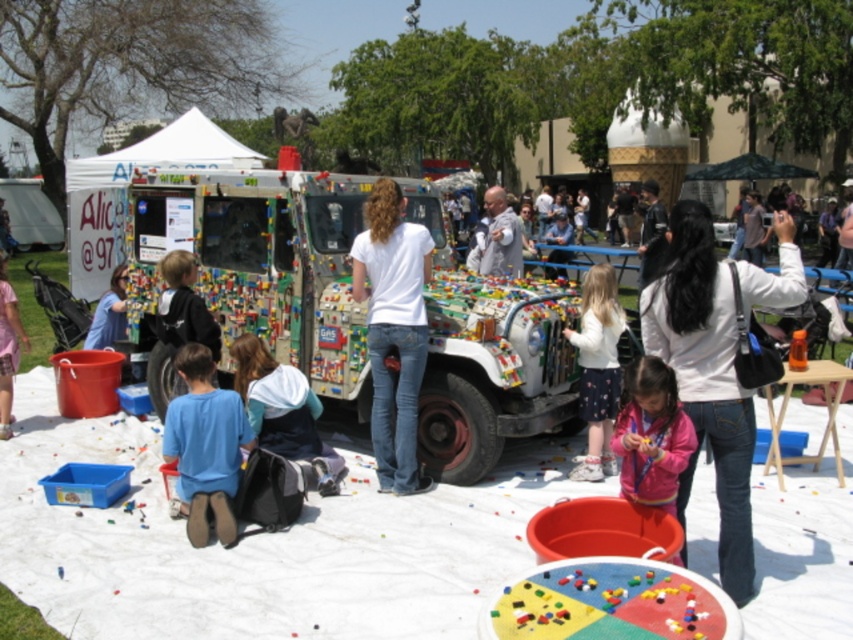
Question: Does brick-patterned plastic food truck at center have a lesser width compared to white matte jacket at upper right?

Choices:
 (A) yes
 (B) no

Answer: (B)

Question: From the image, what is the correct spatial relationship of blue cotton shirt at lower left in relation to blue denim jeans at lower left?

Choices:
 (A) below
 (B) above

Answer: (A)

Question: Considering the real-world distances, which object is farthest from the gray fabric jacket at center?

Choices:
 (A) white matte shirt at center
 (B) brick-patterned plastic food truck at center
 (C) multicolored plastic lego pieces at center
 (D) blue cotton shirt at lower left

Answer: (C)

Question: Is pink fleece jacket at lower center wider than white cotton shirt at center?

Choices:
 (A) yes
 (B) no

Answer: (B)

Question: Which object appears farthest from the camera in this image?

Choices:
 (A) blue denim jeans at lower center
 (B) pink fleece jacket at lower center
 (C) white cotton shirt at center
 (D) multicolored plastic lego pieces at center

Answer: (C)

Question: Among these points, which one is nearest to the camera?

Choices:
 (A) (19, 353)
 (B) (468, 260)
 (C) (579, 337)
 (D) (300, 420)

Answer: (D)